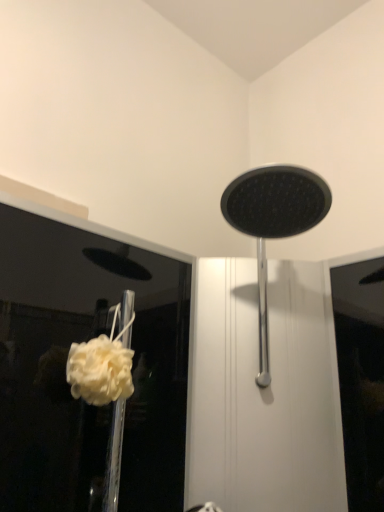
In order to face polished chrome shower head at center, should I rotate leftwards or rightwards?

Rotate right and turn 10.397 degrees.

The height and width of the screenshot is (512, 384). I want to click on polished chrome shower head at center, so click(x=273, y=222).

What do you see at coordinates (273, 222) in the screenshot? I see `polished chrome shower head at center` at bounding box center [273, 222].

This screenshot has height=512, width=384. What do you see at coordinates (100, 370) in the screenshot?
I see `white fluffy sponge at lower left` at bounding box center [100, 370].

Find the location of `white fluffy sponge at lower left`. white fluffy sponge at lower left is located at coordinates (100, 370).

Find the location of `polished chrome shower head at center`. polished chrome shower head at center is located at coordinates (273, 222).

Based on their positions, is polished chrome shower head at center located to the left or right of white fluffy sponge at lower left?

Clearly, polished chrome shower head at center is on the right of white fluffy sponge at lower left in the image.

Does polished chrome shower head at center come in front of white fluffy sponge at lower left?

Yes, polished chrome shower head at center is closer to the viewer.

Is point (237, 212) farther from camera compared to point (117, 351)?

Yes.

From the image's perspective, is polished chrome shower head at center beneath white fluffy sponge at lower left?

No, from the image's perspective, polished chrome shower head at center is not beneath white fluffy sponge at lower left.

From a real-world perspective, between polished chrome shower head at center and white fluffy sponge at lower left, who is vertically higher?

From a 3D spatial view, polished chrome shower head at center is above.

Between polished chrome shower head at center and white fluffy sponge at lower left, which one has smaller width?

white fluffy sponge at lower left.

In the scene shown: Considering the relative sizes of polished chrome shower head at center and white fluffy sponge at lower left in the image provided, is polished chrome shower head at center shorter than white fluffy sponge at lower left?

No, polished chrome shower head at center is not shorter than white fluffy sponge at lower left.

Is polished chrome shower head at center bigger or smaller than white fluffy sponge at lower left?

Clearly, polished chrome shower head at center is larger in size than white fluffy sponge at lower left.

Is white fluffy sponge at lower left located within polished chrome shower head at center?

No, polished chrome shower head at center does not contain white fluffy sponge at lower left.

Is polished chrome shower head at center placed right next to white fluffy sponge at lower left?

No, polished chrome shower head at center is not in contact with white fluffy sponge at lower left.

Is polished chrome shower head at center aimed at white fluffy sponge at lower left?

No, polished chrome shower head at center is not aimed at white fluffy sponge at lower left.

What's the angular difference between polished chrome shower head at center and white fluffy sponge at lower left's facing directions?

The angular difference between polished chrome shower head at center and white fluffy sponge at lower left is 46.9 degrees.

Measure the distance between polished chrome shower head at center and white fluffy sponge at lower left.

polished chrome shower head at center is 13.77 inches from white fluffy sponge at lower left.

Find the location of `shower located in front of the white fluffy sponge at lower left`. shower located in front of the white fluffy sponge at lower left is located at coordinates (273, 222).

Can you confirm if white fluffy sponge at lower left is positioned to the left of polished chrome shower head at center?

Correct, you'll find white fluffy sponge at lower left to the left of polished chrome shower head at center.

Considering the positions of objects white fluffy sponge at lower left and polished chrome shower head at center in the image provided, who is behind, white fluffy sponge at lower left or polished chrome shower head at center?

white fluffy sponge at lower left is more distant.

Is point (86, 380) more distant than point (249, 214)?

No.

Looking at this image, from the image's perspective, between white fluffy sponge at lower left and polished chrome shower head at center, who is located below?

white fluffy sponge at lower left, from the image's perspective.

From a real-world perspective, who is located higher, white fluffy sponge at lower left or polished chrome shower head at center?

polished chrome shower head at center, from a real-world perspective.

Which of these two, white fluffy sponge at lower left or polished chrome shower head at center, is thinner?

Thinner between the two is white fluffy sponge at lower left.

Between white fluffy sponge at lower left and polished chrome shower head at center, which one has more height?

Standing taller between the two is polished chrome shower head at center.

Is white fluffy sponge at lower left bigger than polished chrome shower head at center?

No, white fluffy sponge at lower left is not bigger than polished chrome shower head at center.

Is white fluffy sponge at lower left completely or partially outside of polished chrome shower head at center?

Yes.

Would you say white fluffy sponge at lower left is a long distance from polished chrome shower head at center?

white fluffy sponge at lower left is near polished chrome shower head at center, not far away.

Is white fluffy sponge at lower left facing away from polished chrome shower head at center?

No, white fluffy sponge at lower left is not facing away from polished chrome shower head at center.

How much distance is there between white fluffy sponge at lower left and polished chrome shower head at center?

They are 13.77 inches apart.

You are a GUI agent. You are given a task and a screenshot of the screen. Output one action in this format:
    pyautogui.click(x=<x>, y=<y>)
    Task: Click on the shower above the white fluffy sponge at lower left (from a real-world perspective)
    
    Given the screenshot: What is the action you would take?
    pyautogui.click(x=273, y=222)

Find the location of a particular element. flower that appears below the polished chrome shower head at center (from a real-world perspective) is located at coordinates (100, 370).

Identify the location of flower that appears below the polished chrome shower head at center (from the image's perspective). The width and height of the screenshot is (384, 512). (100, 370).